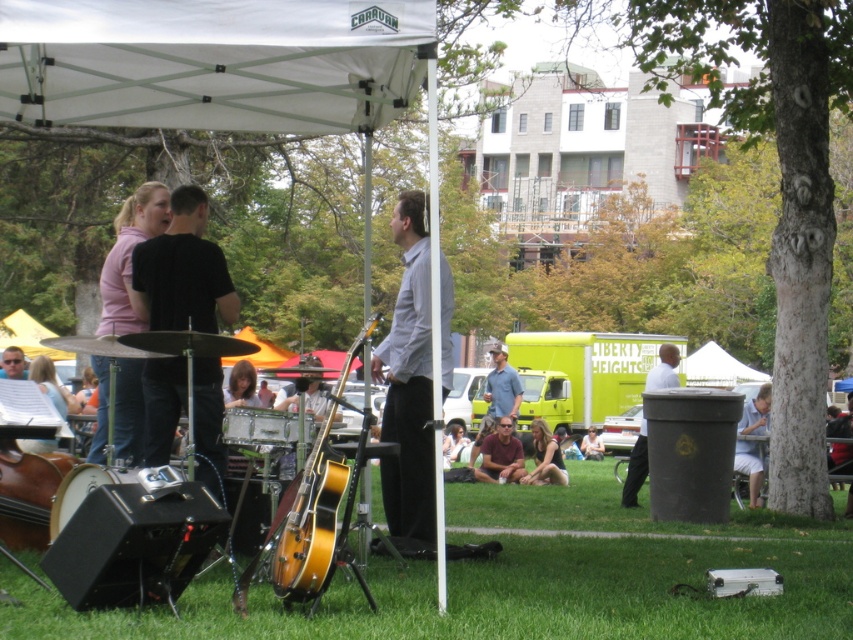
Question: Can you confirm if pink fabric shirt at upper left is positioned below matte black guitar at left?

Choices:
 (A) yes
 (B) no

Answer: (B)

Question: Which point is closer to the camera taking this photo?

Choices:
 (A) (10, 358)
 (B) (425, 458)
 (C) (753, 468)
 (D) (120, 445)

Answer: (D)

Question: Can you confirm if pink fabric shirt at upper left is positioned to the left of light brown hair at lower center?

Choices:
 (A) yes
 (B) no

Answer: (A)

Question: Among these objects, which one is nearest to the camera?

Choices:
 (A) black matte shirt at center
 (B) silver metallic drum at center

Answer: (A)

Question: Which is nearer to the white cotton shirt at lower right?

Choices:
 (A) brown leather jacket at center
 (B) light brown hair at lower center
 (C) blue denim shirt at center
 (D) white matte shirt at lower right

Answer: (D)

Question: Is white matte shirt at lower right below blue denim shirt at center?

Choices:
 (A) no
 (B) yes

Answer: (A)